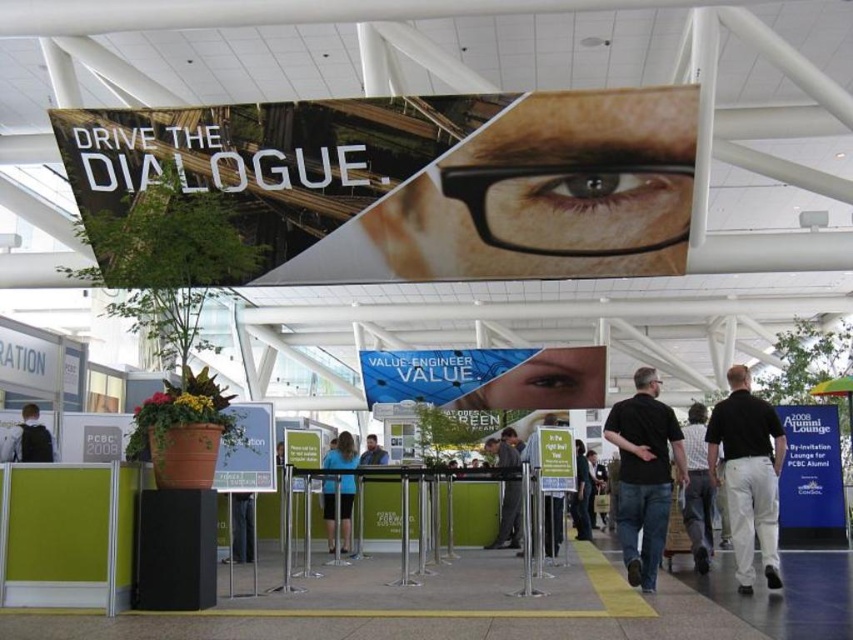
You are an event organizer planning to place a 3D model of a car between the dark blue shirt at center and the matte black shirt at center. Given their sizes, will the car model fit between them without overlapping either shirt?

The dark blue shirt at center occupies less space than the matte black shirt at center. Therefore, the car model can fit between them as there is sufficient space between the two shirts.

You are a photographer setting up a tripod to capture a photo of both the black cotton shirt at center and the blue glossy eye at upper center in the scene. The minimum distance your camera can focus on two objects is 5 meters. Will you be able to capture both objects in focus at the same time?

The black cotton shirt at center and blue glossy eye at upper center are 4.96 meters apart, which is less than the 5 meters minimum focusing distance required. Therefore, the camera can capture both objects in focus simultaneously.